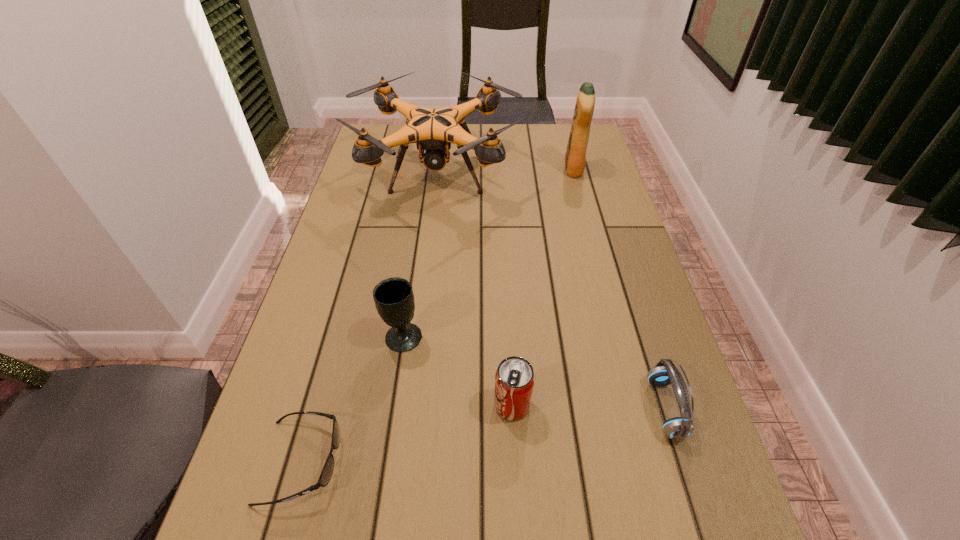
Identify the location of detergent that is at the right edge. (575, 158).

In order to click on headset that is at the right edge in this screenshot , I will do `click(665, 373)`.

Where is `object that is at the far left corner`? The width and height of the screenshot is (960, 540). object that is at the far left corner is located at coordinates (433, 130).

The height and width of the screenshot is (540, 960). Find the location of `vacant region at the far edge`. vacant region at the far edge is located at coordinates (496, 124).

In order to click on free spot at the left edge of the desktop in this screenshot , I will do `click(399, 178)`.

This screenshot has width=960, height=540. I want to click on vacant space at the right edge of the desktop, so click(x=633, y=302).

This screenshot has width=960, height=540. I want to click on vacant space in between the sunglasses and the detergent, so click(x=438, y=315).

Locate an element on the screen. vacant space in between the detergent and the drone is located at coordinates (506, 172).

Identify the location of free space between the headset and the drone. The width and height of the screenshot is (960, 540). (551, 292).

This screenshot has height=540, width=960. I want to click on vacant space that's between the drone and the headset, so click(551, 292).